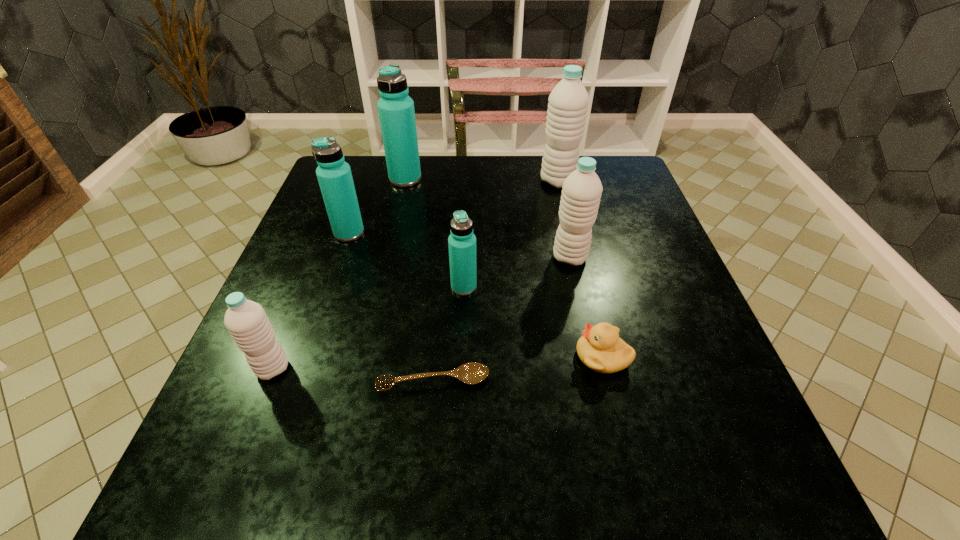
The height and width of the screenshot is (540, 960). I want to click on vacant area that lies between the third farthest object and the shortest object, so click(x=392, y=307).

Locate which object ranks fourth in proximity to the farthest blue water bottle. Please provide its 2D coordinates. Your answer should be formatted as a tuple, i.e. [(x, y)], where the tuple contains the x and y coordinates of a point satisfying the conditions above.

[(582, 189)]

Select which object is the third closest to the biggest white water bottle. Please provide its 2D coordinates. Your answer should be formatted as a tuple, i.e. [(x, y)], where the tuple contains the x and y coordinates of a point satisfying the conditions above.

[(462, 242)]

Point out which water bottle is positioned as the third nearest to the second nearest water bottle. Please provide its 2D coordinates. Your answer should be formatted as a tuple, i.e. [(x, y)], where the tuple contains the x and y coordinates of a point satisfying the conditions above.

[(246, 321)]

Find the location of a particular element. water bottle that is the third closest to the farthest white water bottle is located at coordinates (462, 242).

Find the location of `white water bottle that is the closest to the biggest white water bottle`. white water bottle that is the closest to the biggest white water bottle is located at coordinates (582, 189).

Locate an element on the screen. The height and width of the screenshot is (540, 960). the second closest white water bottle to the shortest object is located at coordinates (582, 189).

Locate which blue water bottle ranks second in proximity to the fourth water bottle from left to right. Please provide its 2D coordinates. Your answer should be formatted as a tuple, i.e. [(x, y)], where the tuple contains the x and y coordinates of a point satisfying the conditions above.

[(396, 111)]

This screenshot has height=540, width=960. Find the location of `blue water bottle identified as the second closest to the ladle`. blue water bottle identified as the second closest to the ladle is located at coordinates (334, 175).

Where is `vacant region that satisfies the following two spatial constraints: 1. on the front side of the sixth nearest object; 2. on the left side of the second nearest white water bottle`? vacant region that satisfies the following two spatial constraints: 1. on the front side of the sixth nearest object; 2. on the left side of the second nearest white water bottle is located at coordinates (341, 257).